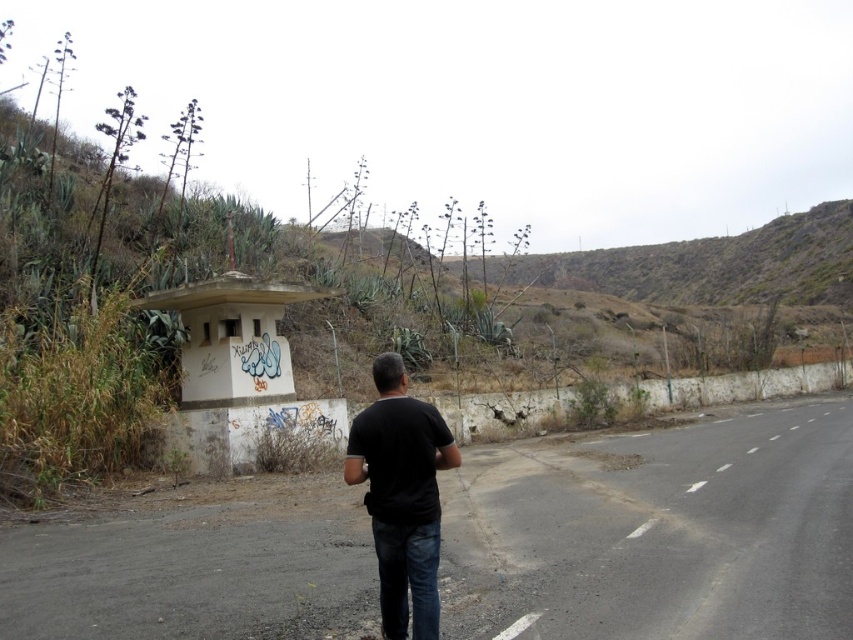
Question: Which object is closer to the camera taking this photo?

Choices:
 (A) black matte shirt at center
 (B) asphalt road at lower right
 (C) smooth asphalt road at center

Answer: (A)

Question: Among these objects, which one is nearest to the camera?

Choices:
 (A) black matte shirt at center
 (B) asphalt road at lower right

Answer: (A)

Question: From the image, what is the correct spatial relationship of asphalt road at lower right in relation to black matte shirt at center?

Choices:
 (A) left
 (B) right

Answer: (B)

Question: Can you confirm if smooth asphalt road at center is positioned to the right of black matte shirt at center?

Choices:
 (A) yes
 (B) no

Answer: (A)

Question: Can you confirm if asphalt road at lower right is smaller than black matte shirt at center?

Choices:
 (A) yes
 (B) no

Answer: (B)

Question: Which object appears farthest from the camera in this image?

Choices:
 (A) smooth asphalt road at center
 (B) asphalt road at lower right

Answer: (B)